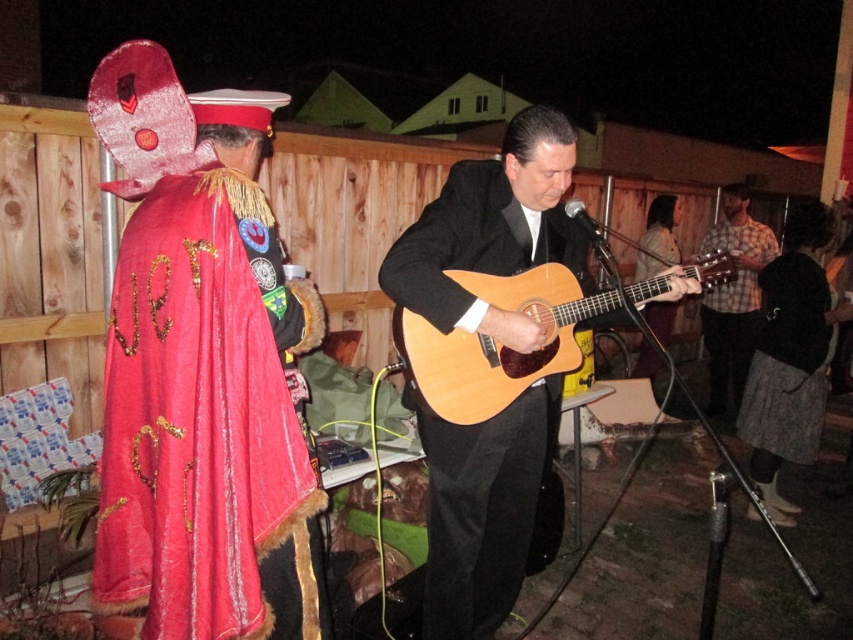
You are standing at point (482, 180) and want to move to the fence in the background. Is there an obstacle blocking your path towards the fence at point (120, 422)?

Point (120, 422) is in front of point (482, 180), so moving towards the fence would have an obstacle at point (120, 422) blocking the path.